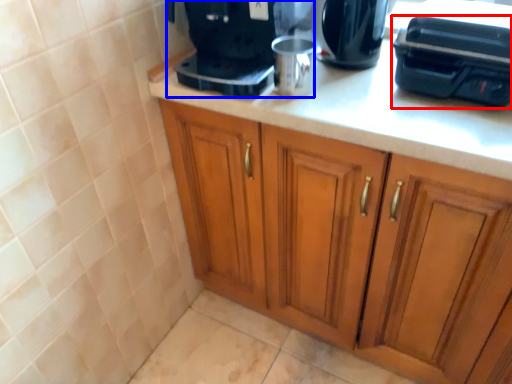
Question: Among these objects, which one is nearest to the camera, appliance (highlighted by a red box) or home appliance (highlighted by a blue box)?

Choices:
 (A) appliance
 (B) home appliance

Answer: (A)